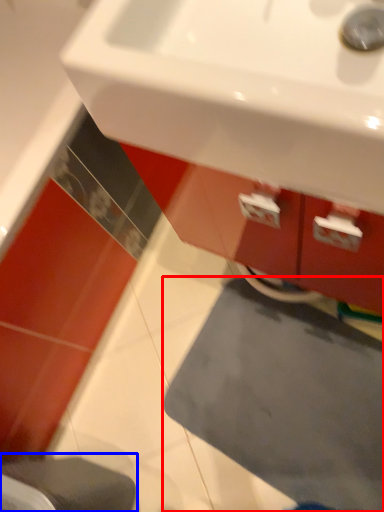
Question: Which point is closer to the camera, bath mat (highlighted by a red box) or step stool (highlighted by a blue box)?

Choices:
 (A) bath mat
 (B) step stool

Answer: (B)